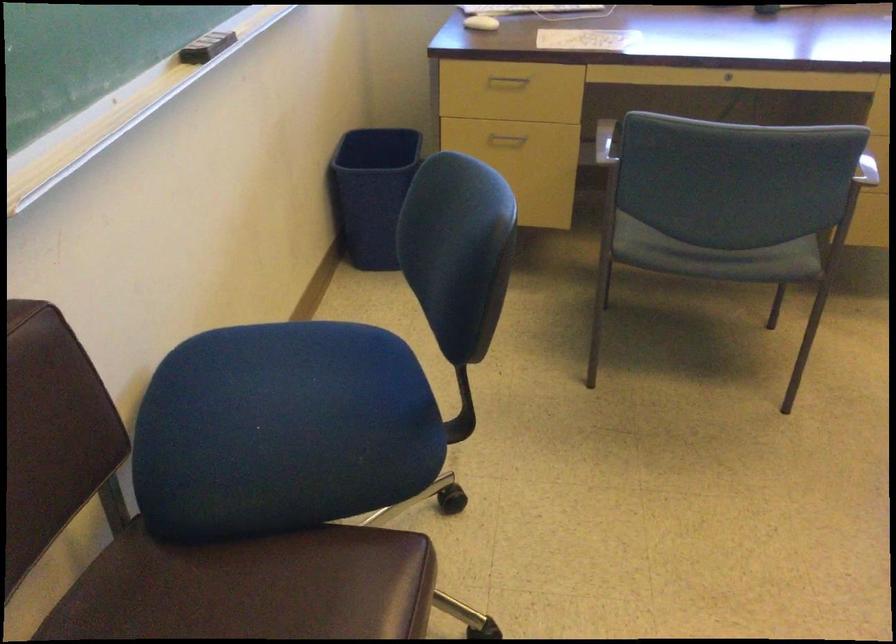
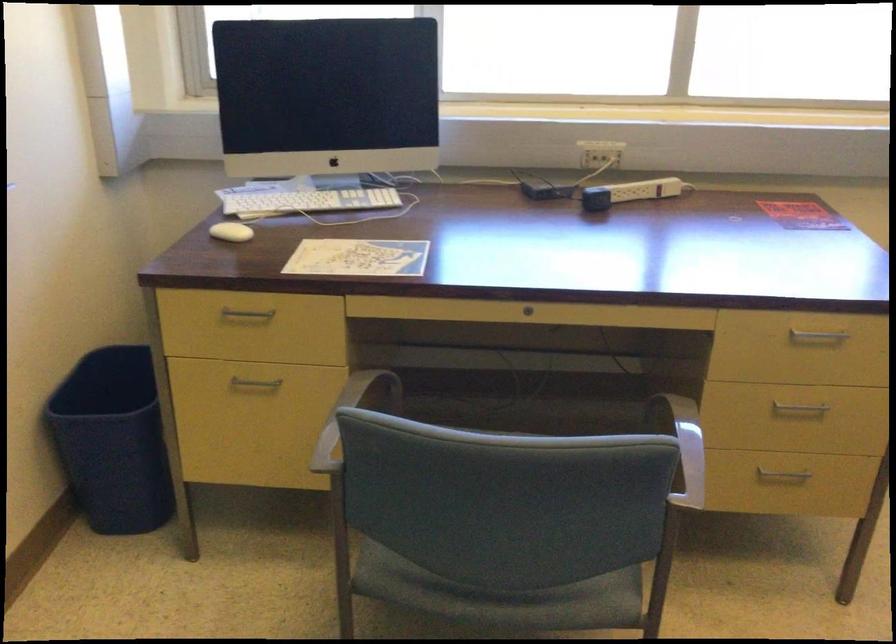
In a continuous first-person perspective shot, in which direction is the camera moving?

The cameraman walked toward right, forward.